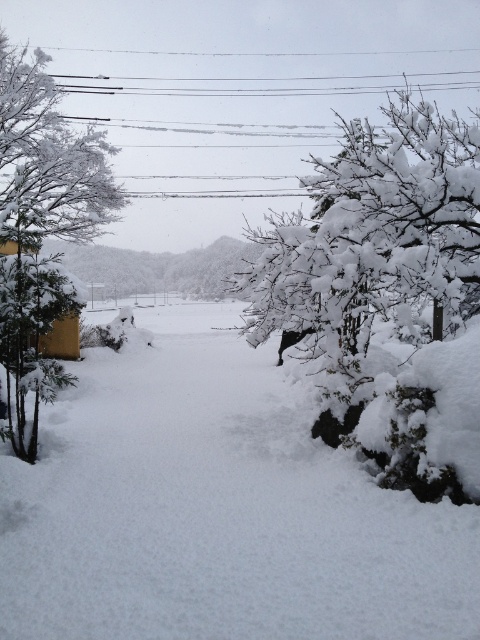
You are a hiker trying to navigate through the snowy path. You see the white fluffy snow at center and the white frosty tree at right. Which object is closer to your current position on the path?

The white fluffy snow at center is closer to your current position on the path because it is located to the left of the white frosty tree at right, which is further along the path.

You are standing at the center of the snow path in the winter scene. You notice two points marked in the image. Which point is closer to you, point (242, 442) or point (23, 419)?

Point (23, 419) is closer to you because it is less further to the viewer than point (242, 442).

You are a hiker trying to navigate through the snowy path. You see the white fluffy snow at center and the white frosty tree at left. Which one is closer to your current position?

The white fluffy snow at center is to the right of the white frosty tree at left, so the white frosty tree at left is closer to your current position.